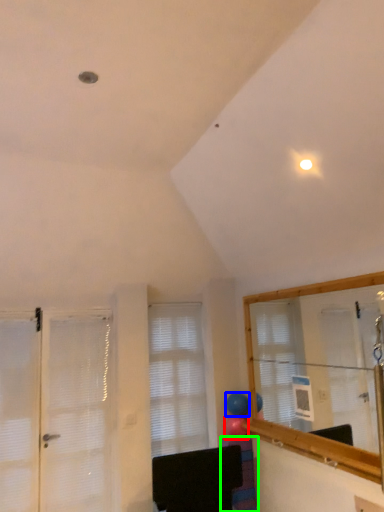
Question: Which object is the farthest from balloon (highlighted by a red box)? Choose among these: balloon (highlighted by a blue box) or furniture (highlighted by a green box).

Choices:
 (A) balloon
 (B) furniture

Answer: (B)